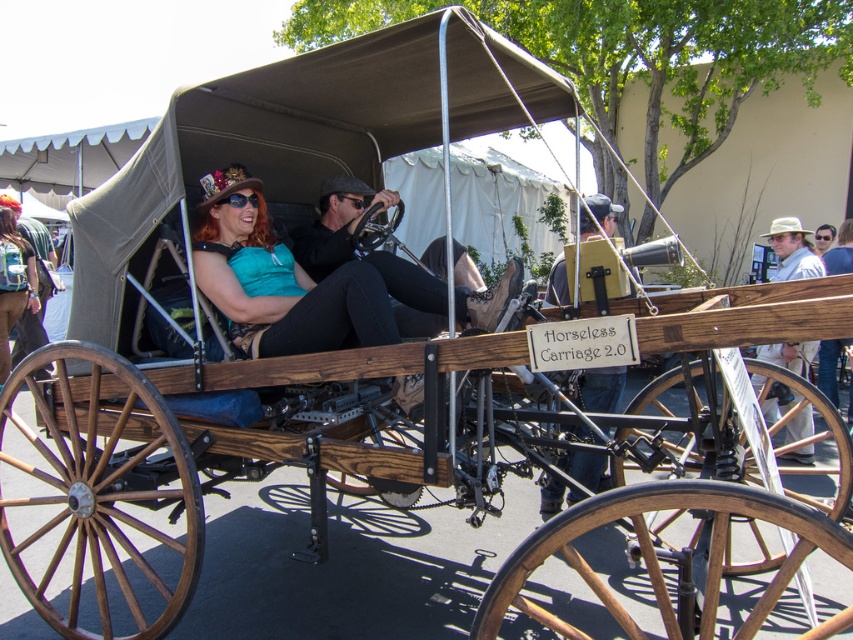
Question: Which point is closer to the camera taking this photo?

Choices:
 (A) (553, 506)
 (B) (439, 316)
 (C) (28, 278)

Answer: (B)

Question: Can you confirm if wooden signboard at center is positioned above light brown straw hat at upper right?

Choices:
 (A) yes
 (B) no

Answer: (B)

Question: Which point appears closest to the camera in this image?

Choices:
 (A) (786, 426)
 (B) (409, 305)

Answer: (B)

Question: Can you confirm if matte black leather steering wheel at center is smaller than wooden signboard at center?

Choices:
 (A) yes
 (B) no

Answer: (B)

Question: Can you confirm if matte black leather steering wheel at center is wider than wooden signboard at center?

Choices:
 (A) no
 (B) yes

Answer: (B)

Question: Among these objects, which one is nearest to the camera?

Choices:
 (A) wooden signboard at center
 (B) light brown straw hat at upper right
 (C) matte black leather steering wheel at center
 (D) matte black backpack at left

Answer: (C)